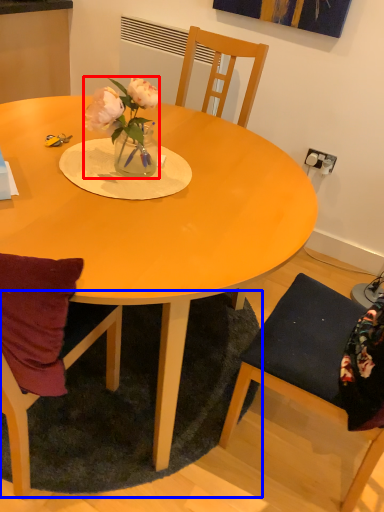
Question: Which object is further to the camera taking this photo, houseplant (highlighted by a red box) or mat (highlighted by a blue box)?

Choices:
 (A) houseplant
 (B) mat

Answer: (B)